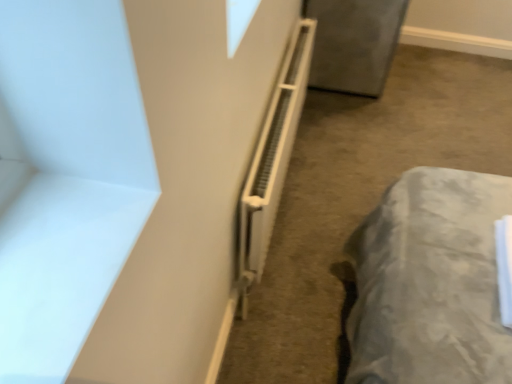
In order to face white matte radiator at center, should I rotate leftwards or rightwards?

It's best to rotate right around 3.947 degrees.

The width and height of the screenshot is (512, 384). Identify the location of white matte radiator at center. (271, 161).

Describe the element at coordinates (271, 161) in the screenshot. I see `white matte radiator at center` at that location.

You are a GUI agent. You are given a task and a screenshot of the screen. Output one action in this format:
    pyautogui.click(x=<x>, y=<y>)
    Task: Click on the white matte radiator at center
    The width and height of the screenshot is (512, 384).
    Given the screenshot: What is the action you would take?
    pyautogui.click(x=271, y=161)